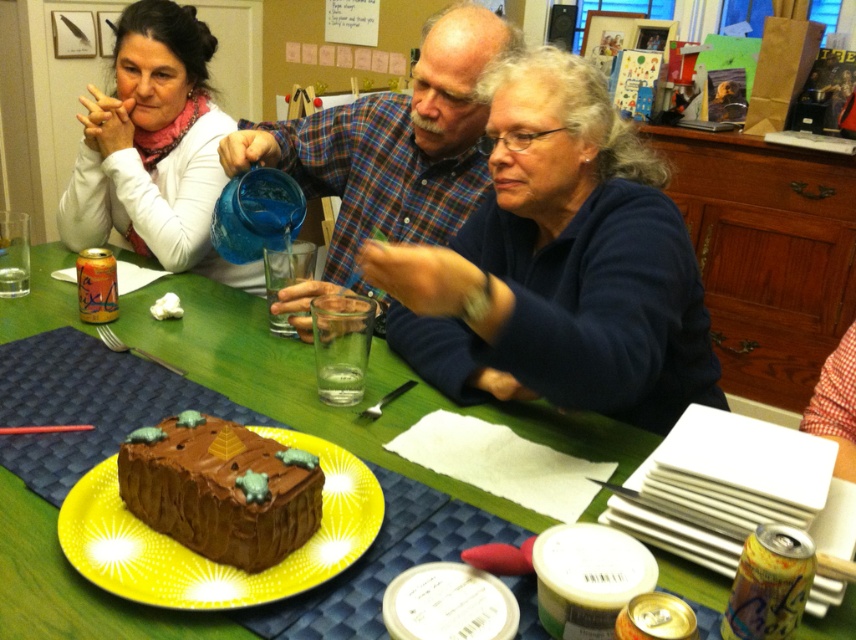
Consider the image. Between green fabric table at center and matte white sweater at upper left, which one appears on the left side from the viewer's perspective?

matte white sweater at upper left

Does green fabric table at center appear over matte white sweater at upper left?

No, green fabric table at center is not above matte white sweater at upper left.

Does point (52, 522) lie behind point (140, 92)?

No.

Locate an element on the screen. The width and height of the screenshot is (856, 640). green fabric table at center is located at coordinates (342, 406).

Between chocolate cake at lower left and green fabric table at center, which one appears on the left side from the viewer's perspective?

green fabric table at center

Does chocolate cake at lower left come behind green fabric table at center?

Yes, chocolate cake at lower left is further from the viewer.

Locate an element on the screen. This screenshot has height=640, width=856. chocolate cake at lower left is located at coordinates (562, 272).

Is point (62, 316) farther from viewer compared to point (207, 502)?

Yes, point (62, 316) is farther from viewer.

Is point (156, 289) closer to camera compared to point (129, 448)?

No, it is behind (129, 448).

Does point (6, 333) lie behind point (270, 456)?

Yes.

At what (x,y) coordinates should I click in order to perform the action: click on green fabric table at center. Please return your answer as a coordinate pair (x, y). Looking at the image, I should click on (342, 406).